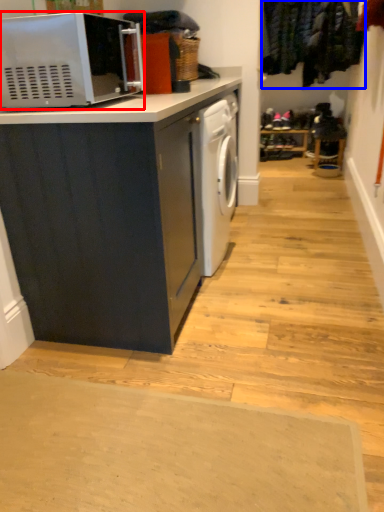
Question: Which of the following is the closest to the observer, microwave oven (highlighted by a red box) or laundry (highlighted by a blue box)?

Choices:
 (A) microwave oven
 (B) laundry

Answer: (A)